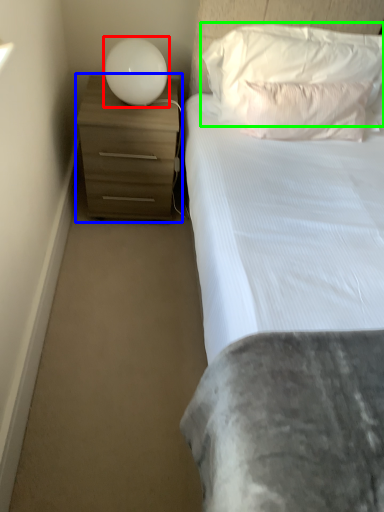
Question: Considering the real-world distances, which object is closest to lamp (highlighted by a red box)? chest of drawers (highlighted by a blue box) or pillow (highlighted by a green box).

Choices:
 (A) chest of drawers
 (B) pillow

Answer: (A)